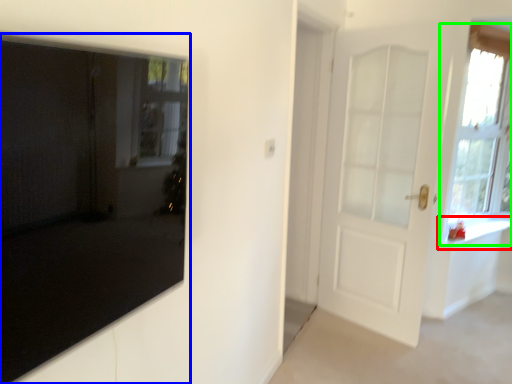
Question: Considering the real-world distances, which object is farthest from window sill (highlighted by a red box)? door (highlighted by a blue box) or window (highlighted by a green box)?

Choices:
 (A) door
 (B) window

Answer: (A)